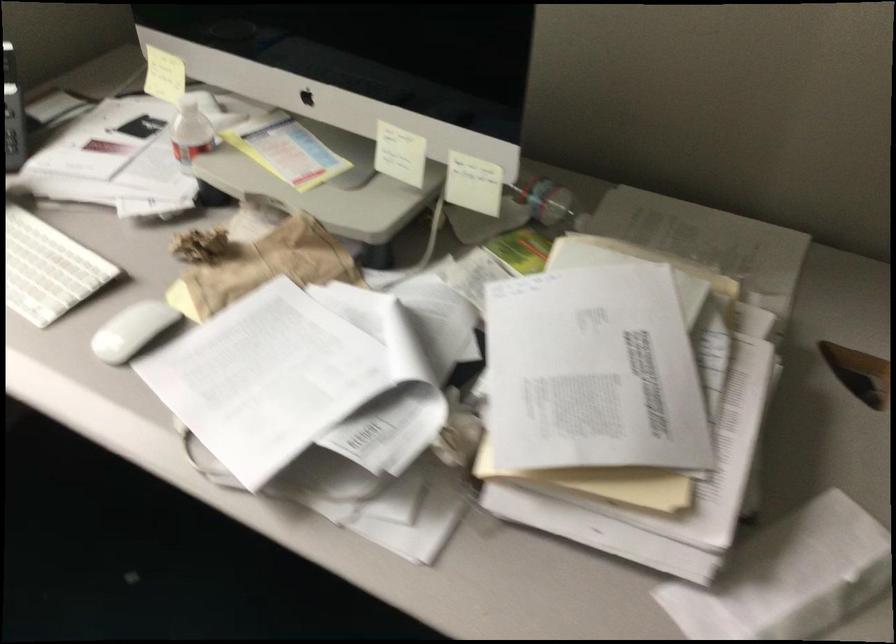
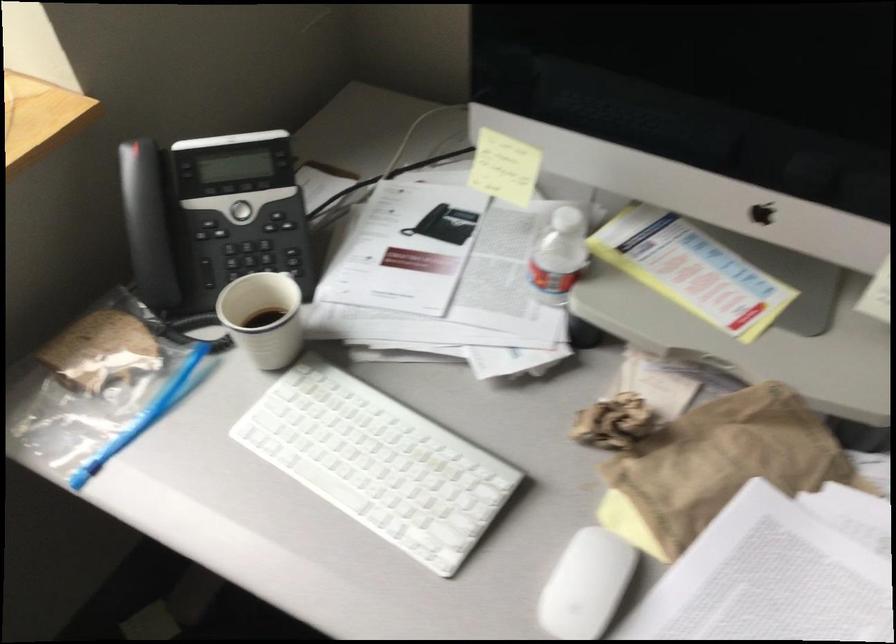
Locate, in the second image, the point that corresponds to point (130, 333) in the first image.

(586, 585)